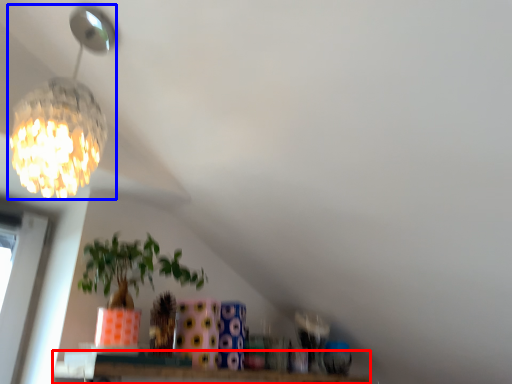
Question: Which point is closer to the camera, window (highlighted by a red box) or lamp (highlighted by a blue box)?

Choices:
 (A) window
 (B) lamp

Answer: (B)